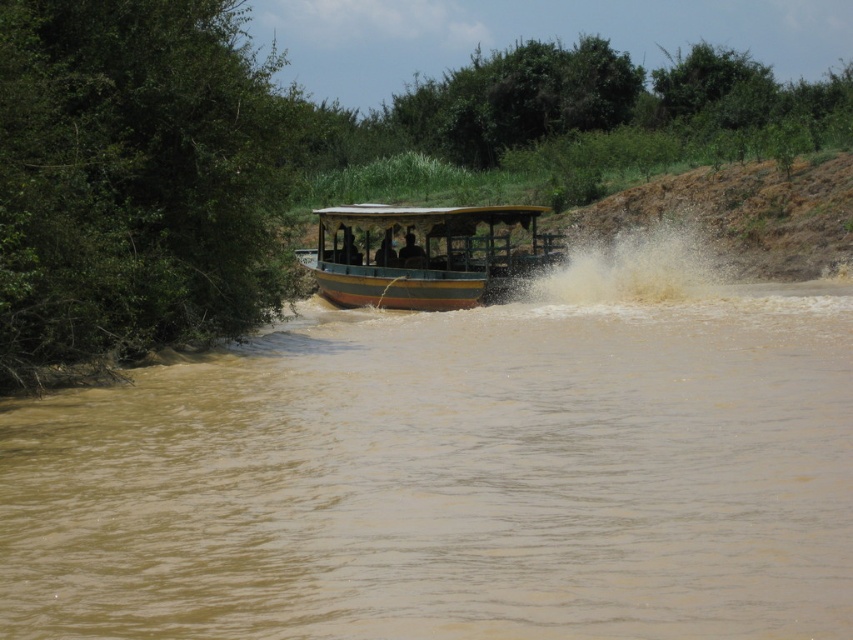
Question: Where is brown muddy water at center located in relation to wooden boat at center in the image?

Choices:
 (A) left
 (B) right

Answer: (B)

Question: Among these objects, which one is nearest to the camera?

Choices:
 (A) wooden boat at center
 (B) brown muddy water at center

Answer: (B)

Question: Which object appears farthest from the camera in this image?

Choices:
 (A) wooden boat at center
 (B) brown muddy water at center
 (C) dark brown wooden boat at center

Answer: (C)

Question: Is wooden boat at center bigger than dark brown wooden boat at center?

Choices:
 (A) no
 (B) yes

Answer: (B)

Question: Is brown muddy water at center to the left of wooden boat at center from the viewer's perspective?

Choices:
 (A) yes
 (B) no

Answer: (B)

Question: Among these points, which one is farthest from the camera?

Choices:
 (A) (418, 276)
 (B) (398, 253)
 (C) (807, 547)

Answer: (B)